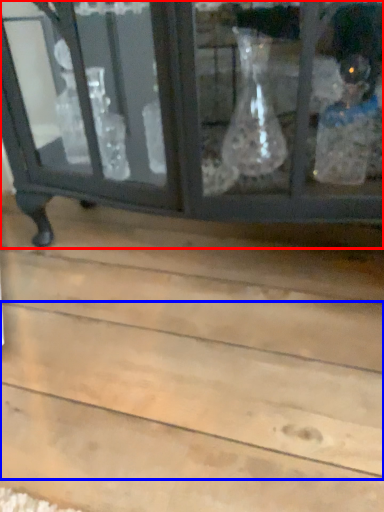
Question: Among these objects, which one is farthest to the camera, furniture (highlighted by a red box) or plank (highlighted by a blue box)?

Choices:
 (A) furniture
 (B) plank

Answer: (A)